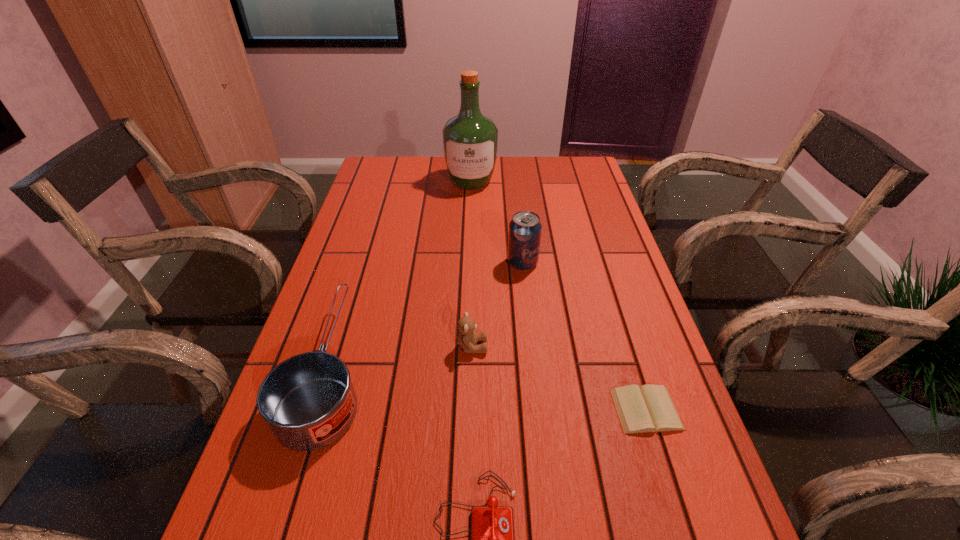
Image resolution: width=960 pixels, height=540 pixels. Identify the location of vacant space located 0.300m with the handle extending from one side of the saucepan. (372, 233).

In order to click on vacant area located 0.360m with the handle extending from one side of the saucepan in this screenshot , I will do `click(375, 221)`.

What are the coordinates of `free region located with the handle extending from one side of the saucepan` in the screenshot? It's located at (361, 268).

The width and height of the screenshot is (960, 540). I want to click on blank area located 0.170m on the face of the teddy bear, so (563, 347).

In order to click on free space located 0.340m on the left of the diary in this screenshot , I will do `click(443, 409)`.

Identify the location of object at the far edge. This screenshot has width=960, height=540. (470, 140).

Where is `object that is at the left edge`? This screenshot has height=540, width=960. object that is at the left edge is located at coordinates (308, 401).

Where is `object that is at the right edge`? The image size is (960, 540). object that is at the right edge is located at coordinates (649, 408).

In the image, there is a desktop. At what (x,y) coordinates should I click in order to perform the action: click on vacant space at the far edge. Please return your answer as a coordinate pair (x, y). This screenshot has width=960, height=540. Looking at the image, I should click on (543, 161).

At what (x,y) coordinates should I click in order to perform the action: click on vacant space at the left edge. Please return your answer as a coordinate pair (x, y). The height and width of the screenshot is (540, 960). Looking at the image, I should click on (386, 254).